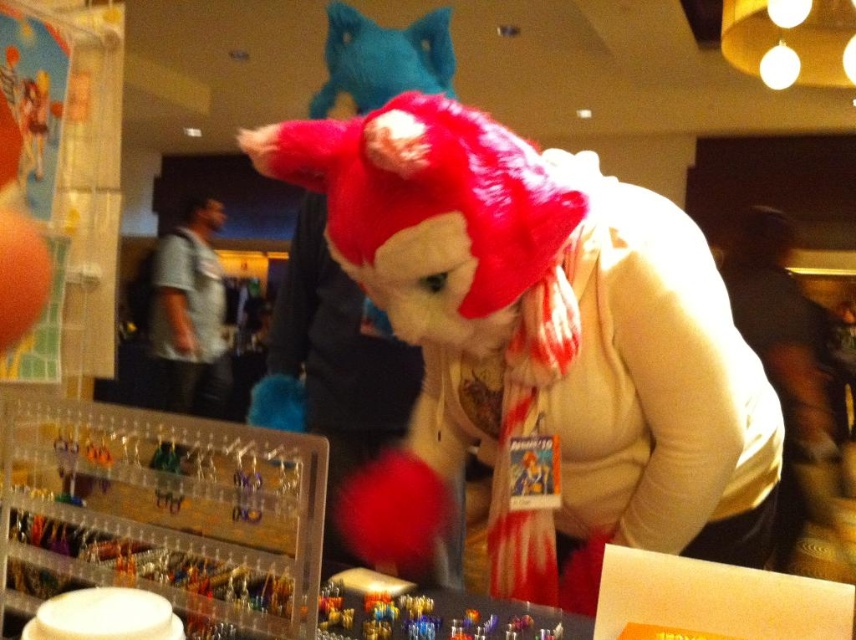
Between point (413, 275) and point (742, 324), which one is positioned behind?

Point (742, 324)

Who is positioned more to the left, fuzzy red plush toy at center or white soft scarf at center?

fuzzy red plush toy at center

This screenshot has width=856, height=640. What do you see at coordinates (535, 344) in the screenshot?
I see `fuzzy red plush toy at center` at bounding box center [535, 344].

Where is `fuzzy red plush toy at center`? The height and width of the screenshot is (640, 856). fuzzy red plush toy at center is located at coordinates (535, 344).

Does white soft scarf at center appear over velvet teal cat at upper center?

No, white soft scarf at center is not above velvet teal cat at upper center.

Is white soft scarf at center below velvet teal cat at upper center?

Correct, white soft scarf at center is located below velvet teal cat at upper center.

Which is in front, point (794, 484) or point (403, 32)?

Point (403, 32) is in front.

This screenshot has height=640, width=856. I want to click on white soft scarf at center, so 786,362.

Who is taller, fuzzy red plush toy at center or velvet teal cat at upper center?

fuzzy red plush toy at center

Who is positioned more to the left, fuzzy red plush toy at center or velvet teal cat at upper center?

velvet teal cat at upper center is more to the left.

Locate an element on the screen. The height and width of the screenshot is (640, 856). fuzzy red plush toy at center is located at coordinates (535, 344).